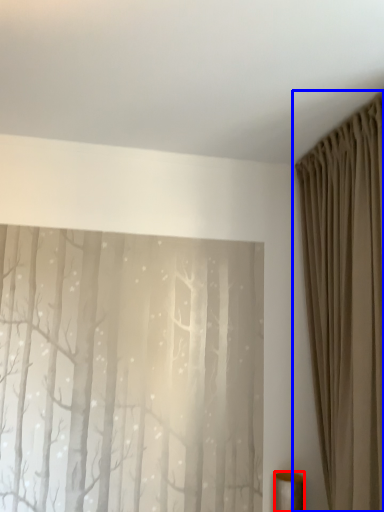
Question: Among these objects, which one is farthest to the camera, furniture (highlighted by a red box) or curtain (highlighted by a blue box)?

Choices:
 (A) furniture
 (B) curtain

Answer: (A)